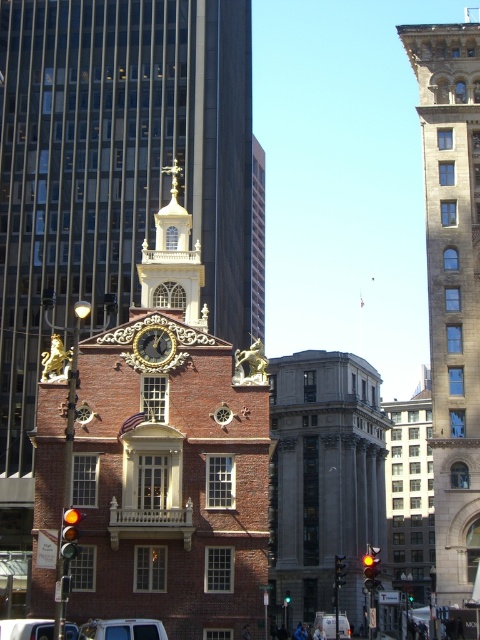
Is metallic silver van at lower center positioned behind gold metallic clock at center?

No, it is in front of gold metallic clock at center.

Can you confirm if metallic silver van at lower center is positioned above gold metallic clock at center?

No.

Is point (143, 627) positioned after point (137, 337)?

That is False.

At what (x,y) coordinates should I click in order to perform the action: click on metallic silver van at lower center. Please return your answer as a coordinate pair (x, y). This screenshot has width=480, height=640. Looking at the image, I should click on (122, 628).

Is stone tower at right positioned before white matte van at center?

That is True.

Can you confirm if stone tower at right is bigger than white matte van at center?

Yes, stone tower at right is bigger than white matte van at center.

Does point (464, 348) come in front of point (315, 625)?

Yes.

You are a GUI agent. You are given a task and a screenshot of the screen. Output one action in this format:
    pyautogui.click(x=<x>, y=<y>)
    Task: Click on the stone tower at right
    
    Given the screenshot: What is the action you would take?
    pyautogui.click(x=452, y=288)

Locate an element on the screen. gold metallic clock at center is located at coordinates (155, 346).

Does gold metallic clock at center appear on the right side of white matte van at center?

No, gold metallic clock at center is not to the right of white matte van at center.

The image size is (480, 640). I want to click on gold metallic clock at center, so click(155, 346).

Locate an element on the screen. The width and height of the screenshot is (480, 640). gold metallic clock at center is located at coordinates (155, 346).